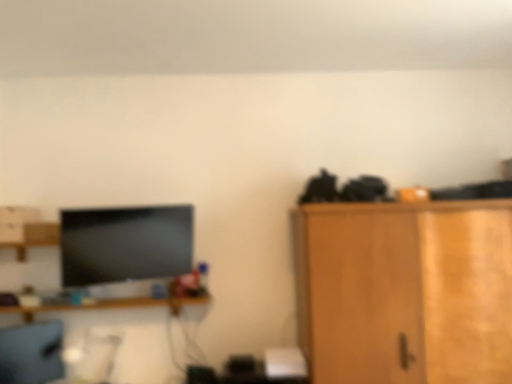
Question: Is wooden shelf at center inside or outside of matte gray computer chair at lower left?

Choices:
 (A) outside
 (B) inside

Answer: (A)

Question: Considering the relative positions of wooden shelf at center and matte gray computer chair at lower left in the image provided, is wooden shelf at center to the left or to the right of matte gray computer chair at lower left?

Choices:
 (A) left
 (B) right

Answer: (B)

Question: Which object is positioned farthest from the wooden shelf at center?

Choices:
 (A) matte gray computer chair at lower left
 (B) wooden cabinet at right

Answer: (B)

Question: Which object is positioned closest to the wooden shelf at center?

Choices:
 (A) matte gray computer chair at lower left
 (B) wooden cabinet at right

Answer: (A)